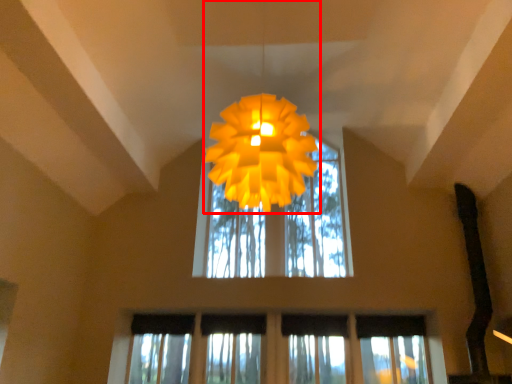
Question: Where is lamp (annotated by the red box) located in relation to window in the image?

Choices:
 (A) left
 (B) right

Answer: (A)